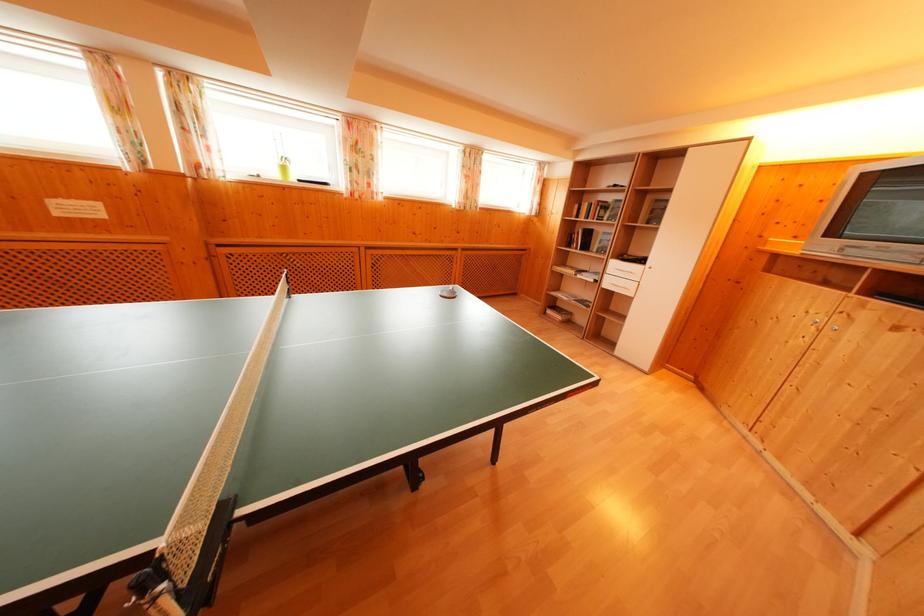
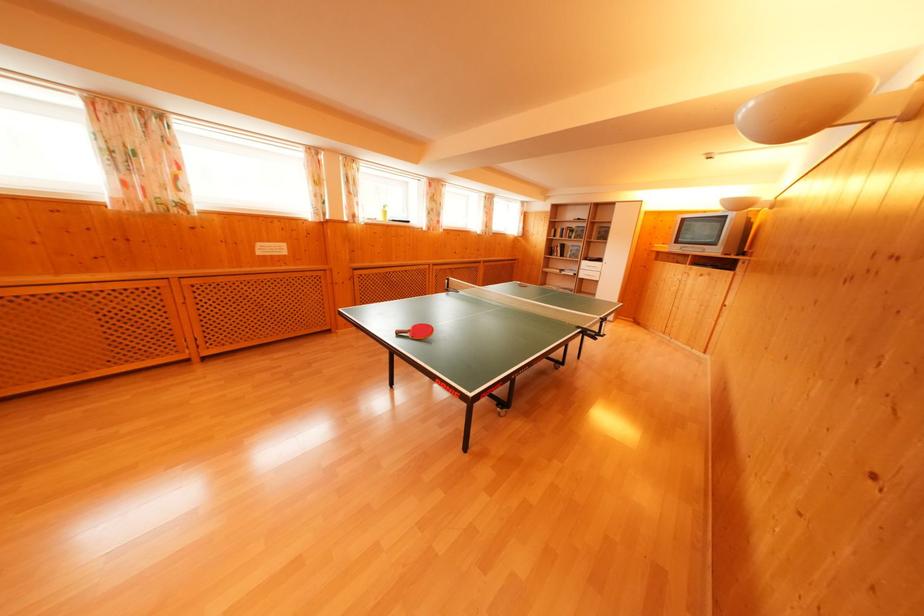
Looking at this image, what movement of the cameraman would produce the second image?

The cameraman walked toward left, backward.